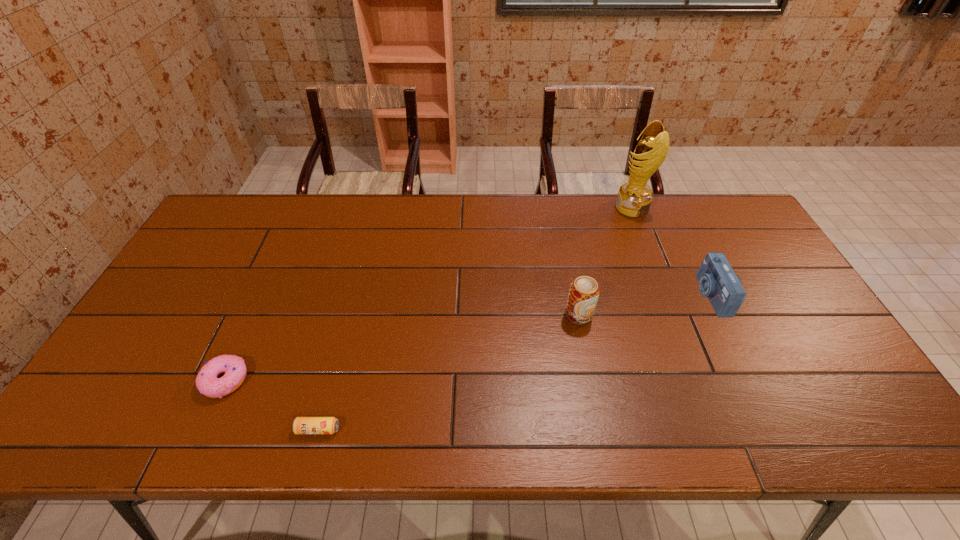
I want to click on object positioned at the near edge, so click(x=302, y=425).

Locate an element on the screen. This screenshot has width=960, height=540. free location at the far edge is located at coordinates click(x=295, y=235).

In the image, there is a desktop. Identify the location of vacant space at the near edge. The width and height of the screenshot is (960, 540). coord(766,437).

Locate an element on the screen. The width and height of the screenshot is (960, 540). vacant area at the left edge of the desktop is located at coordinates (232, 253).

In the image, there is a desktop. In order to click on free space at the right edge in this screenshot , I will do `click(824, 393)`.

The width and height of the screenshot is (960, 540). Identify the location of vacant space at the far left corner of the desktop. (252, 208).

Locate an element on the screen. This screenshot has width=960, height=540. vacant position at the near right corner of the desktop is located at coordinates (886, 435).

What are the coordinates of `free space between the tallest object and the second shortest object` in the screenshot? It's located at (429, 294).

The height and width of the screenshot is (540, 960). I want to click on vacant space in between the taller beer can and the third shortest object, so pyautogui.click(x=645, y=305).

Image resolution: width=960 pixels, height=540 pixels. I want to click on empty location between the right beer can and the third shortest object, so click(645, 305).